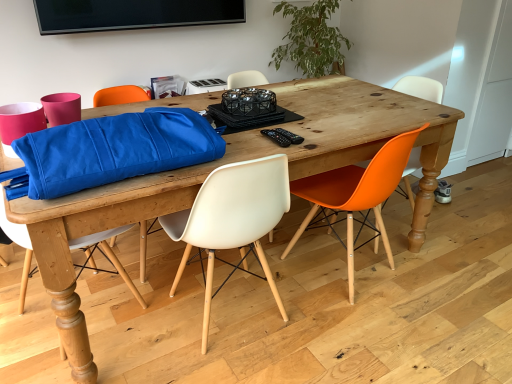
This screenshot has height=384, width=512. In order to click on free space to the right of black plastic remote control at center, the 1th remote control in the left-to-right sequence in this screenshot , I will do `click(315, 135)`.